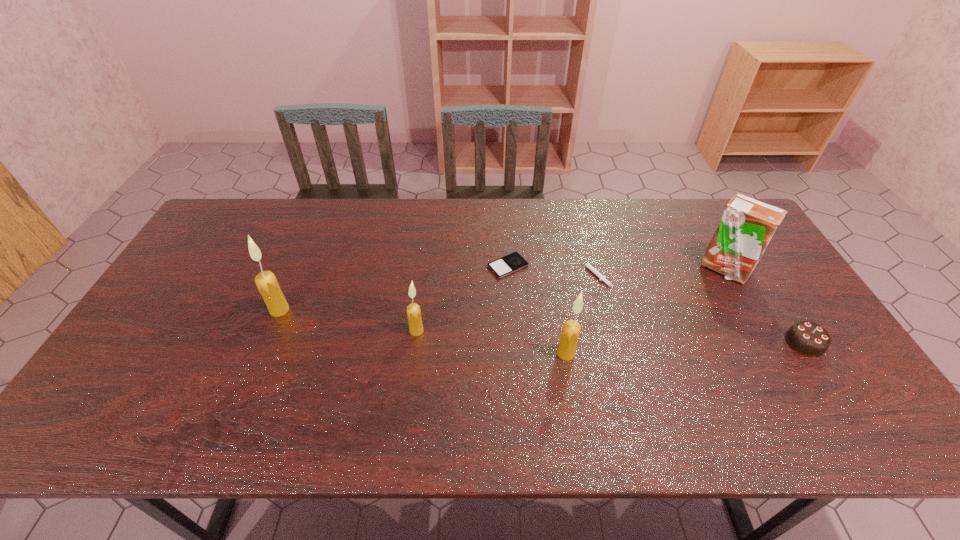
Locate an element on the screen. chocolate cake located at the right edge is located at coordinates (807, 338).

Find the location of a particular element. vacant space at the far edge of the desktop is located at coordinates (281, 198).

In the image, there is a desktop. Where is `vacant area at the near edge`? This screenshot has height=540, width=960. vacant area at the near edge is located at coordinates (749, 386).

The width and height of the screenshot is (960, 540). Find the location of `vacant space at the far left corner of the desktop`. vacant space at the far left corner of the desktop is located at coordinates click(248, 224).

The height and width of the screenshot is (540, 960). I want to click on vacant space at the far right corner of the desktop, so click(x=713, y=200).

The width and height of the screenshot is (960, 540). I want to click on free space between the chocolate cake and the fourth nearest object, so click(542, 326).

In order to click on free space between the farthest candle and the fifth object from left to right in this screenshot , I will do `click(437, 292)`.

Find the location of a particular element. The height and width of the screenshot is (540, 960). free space between the carton and the chocolate cake is located at coordinates (764, 306).

Find the location of `unoccupied position between the nearest candle and the sixth tallest object`. unoccupied position between the nearest candle and the sixth tallest object is located at coordinates (581, 313).

You are a GUI agent. You are given a task and a screenshot of the screen. Output one action in this format:
    pyautogui.click(x=<x>, y=<y>)
    Task: Click on the vacant space that's between the carton and the nearest candle
    The image size is (960, 540).
    Given the screenshot: What is the action you would take?
    pyautogui.click(x=645, y=311)